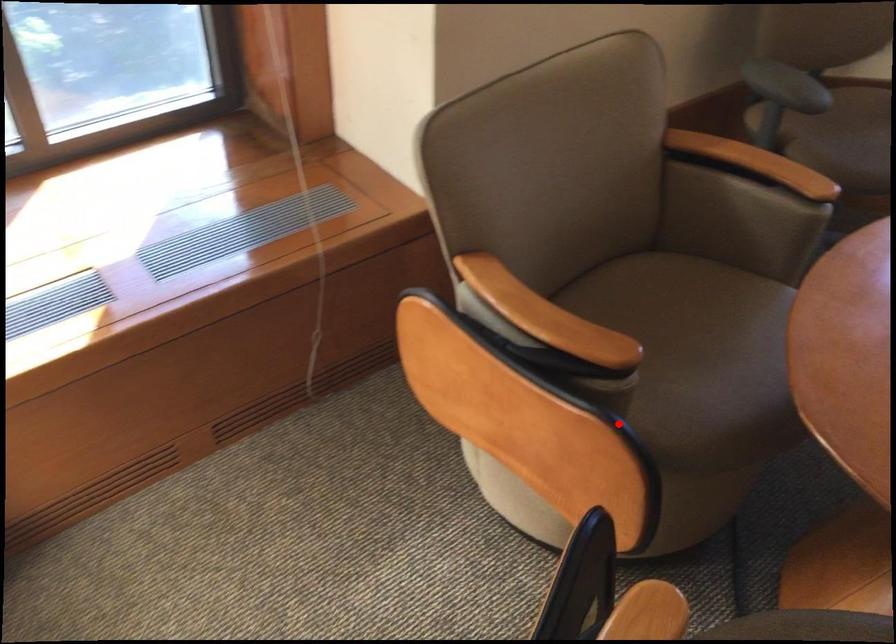
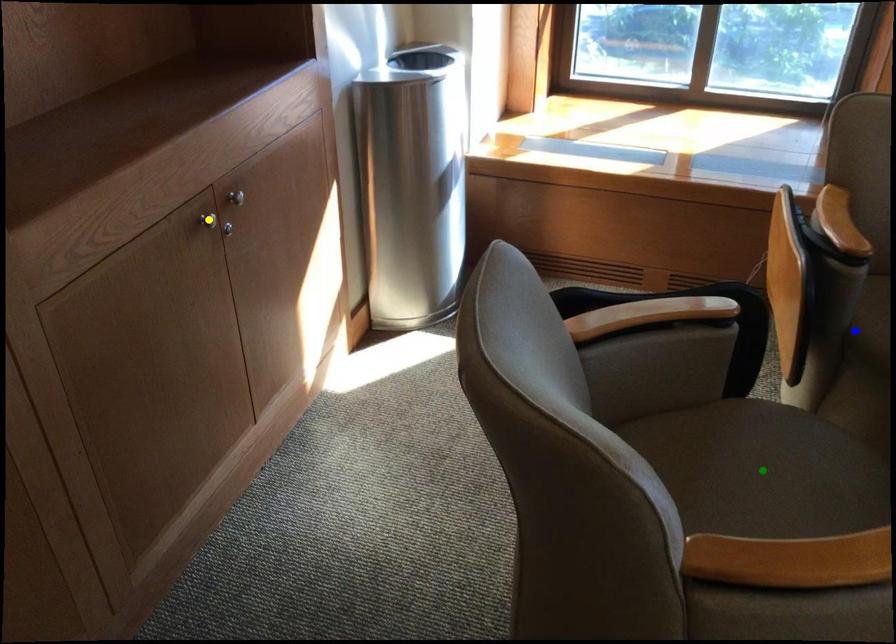
Question: I am providing you with two images of the same scene from different viewpoints. A red point is marked on the first image. You are given multiple points on the second image. Which point in image 2 represents the same 3d spot as the red point in image 1?

Choices:
 (A) yellow point
 (B) green point
 (C) blue point

Answer: (C)